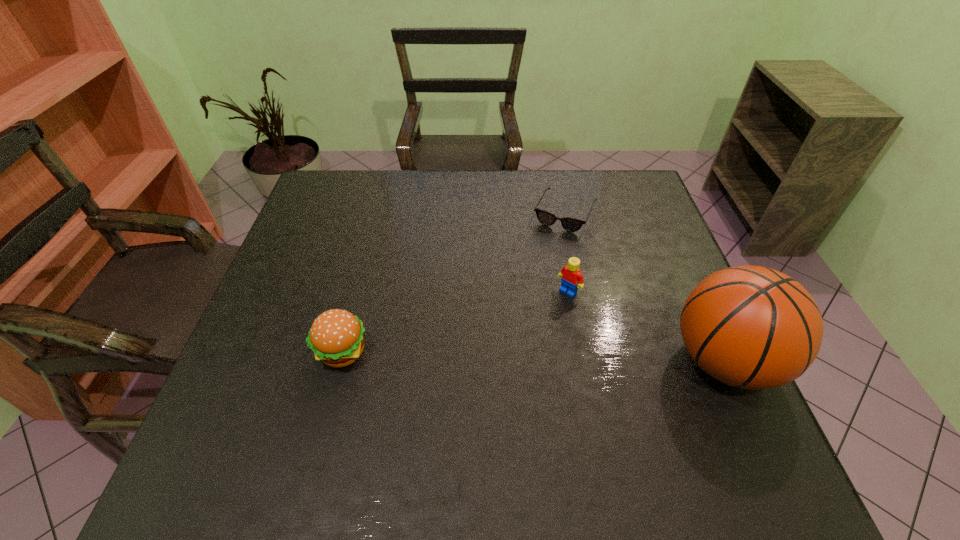
Where is `free region at the near edge`? The height and width of the screenshot is (540, 960). free region at the near edge is located at coordinates (454, 397).

In the image, there is a desktop. What are the coordinates of `vacant space at the left edge` in the screenshot? It's located at (353, 225).

Identify the location of blank space at the far left corner. (331, 205).

Identify the location of blank space at the near left corner of the desktop. The width and height of the screenshot is (960, 540). (232, 428).

In the image, there is a desktop. At what (x,y) coordinates should I click in order to perform the action: click on free space at the far right corner. Please return your answer as a coordinate pair (x, y). Looking at the image, I should click on (614, 172).

Where is `unoccupied area between the tallest object and the hamburger`? The image size is (960, 540). unoccupied area between the tallest object and the hamburger is located at coordinates (533, 356).

Identify the location of empty space between the second farthest object and the leftmost object. The width and height of the screenshot is (960, 540). (455, 321).

This screenshot has width=960, height=540. Find the location of `free space between the rightmost object and the sunglasses`. free space between the rightmost object and the sunglasses is located at coordinates coord(644,287).

The width and height of the screenshot is (960, 540). I want to click on free point between the shortest object and the rightmost object, so click(644, 287).

Find the location of a particular element. This screenshot has width=960, height=540. unoccupied area between the leftmost object and the sunglasses is located at coordinates (453, 282).